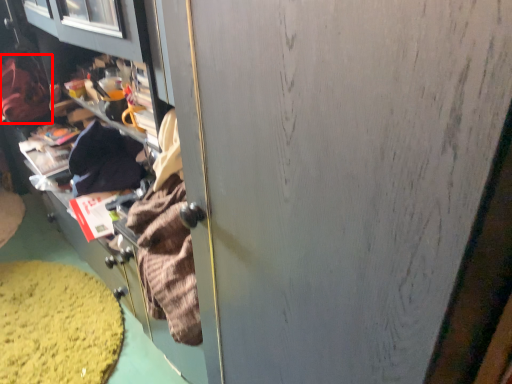
Question: In this image, where is clothing (annotated by the red box) located relative to debris?

Choices:
 (A) left
 (B) right

Answer: (A)